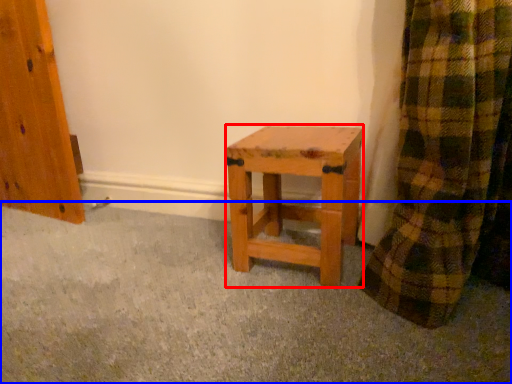
Question: Which object appears closest to the camera in this image, stool (highlighted by a red box) or concrete (highlighted by a blue box)?

Choices:
 (A) stool
 (B) concrete

Answer: (B)